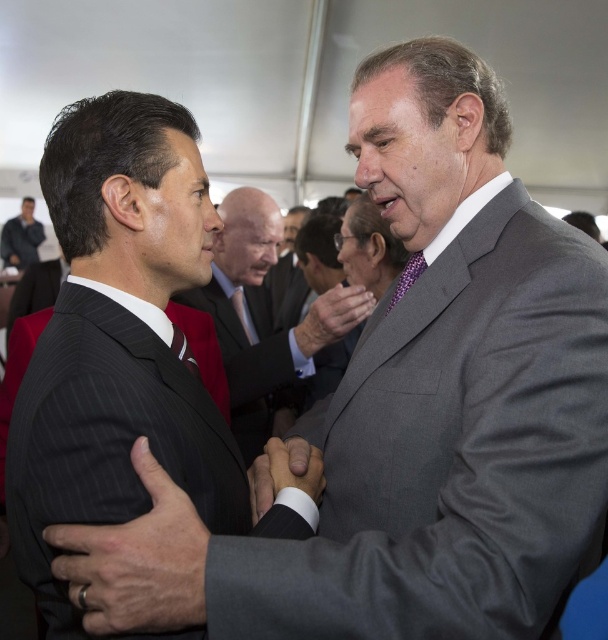
Question: Is matte black suit at center to the right of purple textured tie at center from the viewer's perspective?

Choices:
 (A) no
 (B) yes

Answer: (A)

Question: Which point is closer to the camera?

Choices:
 (A) (257, 490)
 (B) (308, 314)

Answer: (A)

Question: Can you confirm if matte black suit at upper left is thinner than purple textured tie at center?

Choices:
 (A) no
 (B) yes

Answer: (A)

Question: Where is black pinstripe suit at center located in relation to matte black suit at upper left in the image?

Choices:
 (A) above
 (B) below

Answer: (B)

Question: Which point is closer to the camera?

Choices:
 (A) purple textured tie at center
 (B) smooth black hand at center

Answer: (B)

Question: Among these points, which one is nearest to the camera?

Choices:
 (A) (7, 228)
 (B) (182, 612)
 (C) (188, 492)

Answer: (B)